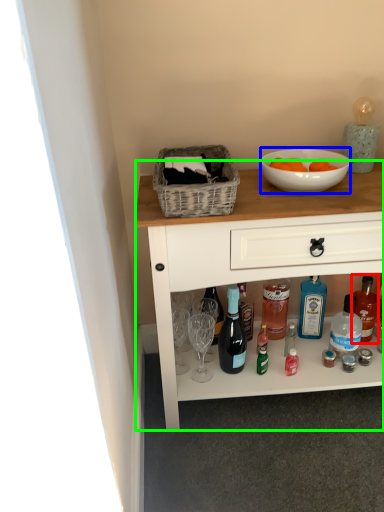
Question: Which object is the farthest from bottle (highlighted by a red box)? Choose among these: bowl (highlighted by a blue box) or desk (highlighted by a green box).

Choices:
 (A) bowl
 (B) desk

Answer: (A)